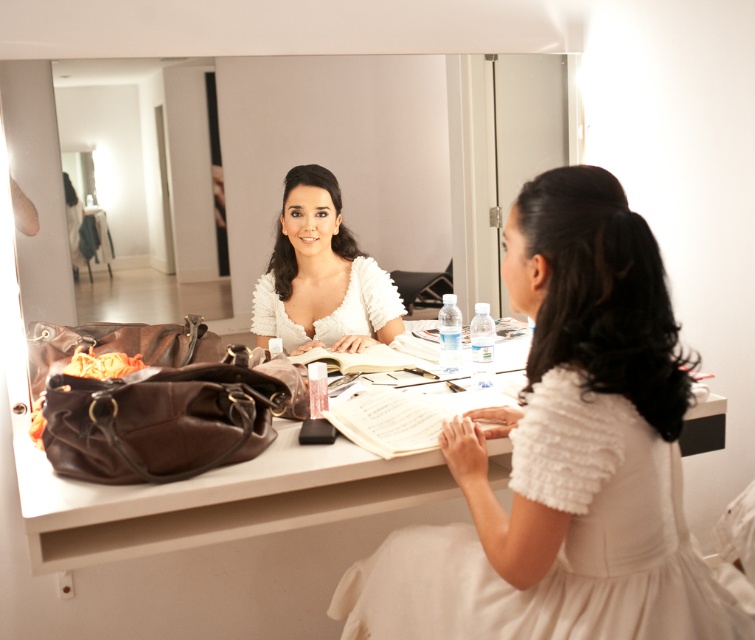
Question: From the image, what is the correct spatial relationship of clear glass mirror at upper center in relation to white fluffy dress at center?

Choices:
 (A) above
 (B) below

Answer: (A)

Question: Can you confirm if clear glass mirror at upper center is thinner than white ruffled dress at center?

Choices:
 (A) yes
 (B) no

Answer: (B)

Question: Which object is farther from the camera taking this photo?

Choices:
 (A) brown leather vanity at center
 (B) white fluffy dress at center
 (C) white ruffled dress at center

Answer: (C)

Question: Can you confirm if brown leather vanity at center is wider than white ruffled dress at center?

Choices:
 (A) yes
 (B) no

Answer: (A)

Question: Which is farther from the white fluffy dress at center?

Choices:
 (A) clear glass mirror at upper center
 (B) white ruffled dress at center
 (C) brown leather vanity at center

Answer: (A)

Question: Which is farther from the white fluffy dress at center?

Choices:
 (A) white ruffled dress at center
 (B) clear glass mirror at upper center
 (C) brown leather vanity at center

Answer: (B)